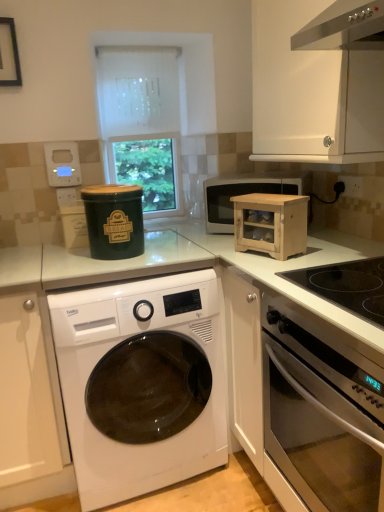
Identify the location of free space underneath natural wood cabinet at right (from a real-world perspective). The height and width of the screenshot is (512, 384). (258, 255).